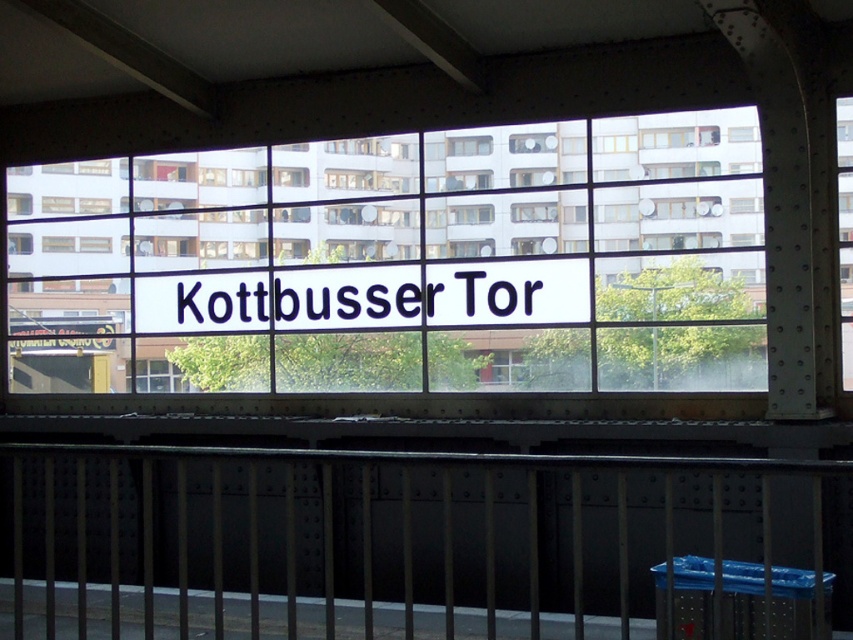
Question: Is transparent glass sign at center wider than black metal rail at center?

Choices:
 (A) yes
 (B) no

Answer: (B)

Question: Which point is farther to the camera?

Choices:
 (A) transparent glass sign at center
 (B) black metal rail at center

Answer: (A)

Question: Can you confirm if transparent glass sign at center is positioned above black metal rail at center?

Choices:
 (A) yes
 (B) no

Answer: (A)

Question: Can you confirm if transparent glass sign at center is thinner than black metal rail at center?

Choices:
 (A) yes
 (B) no

Answer: (A)